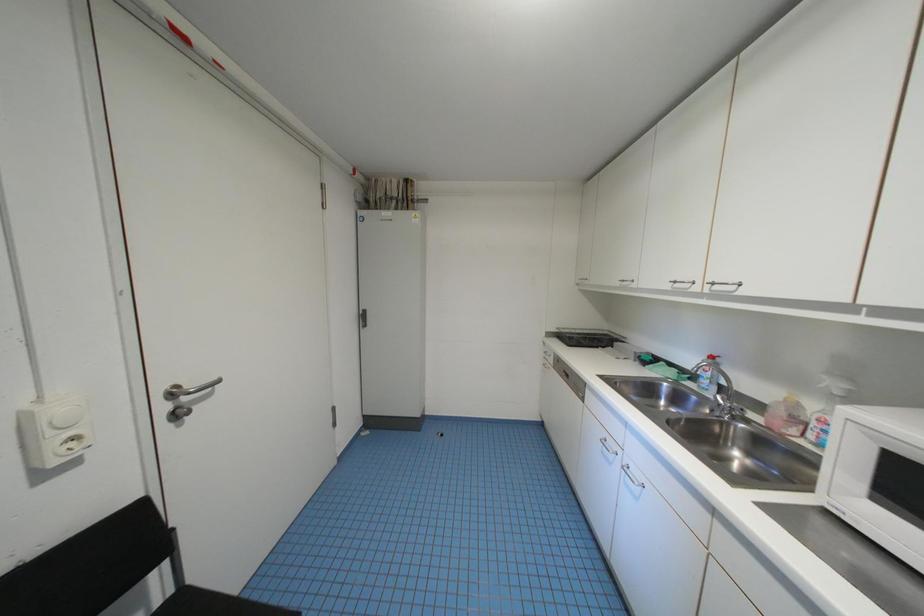
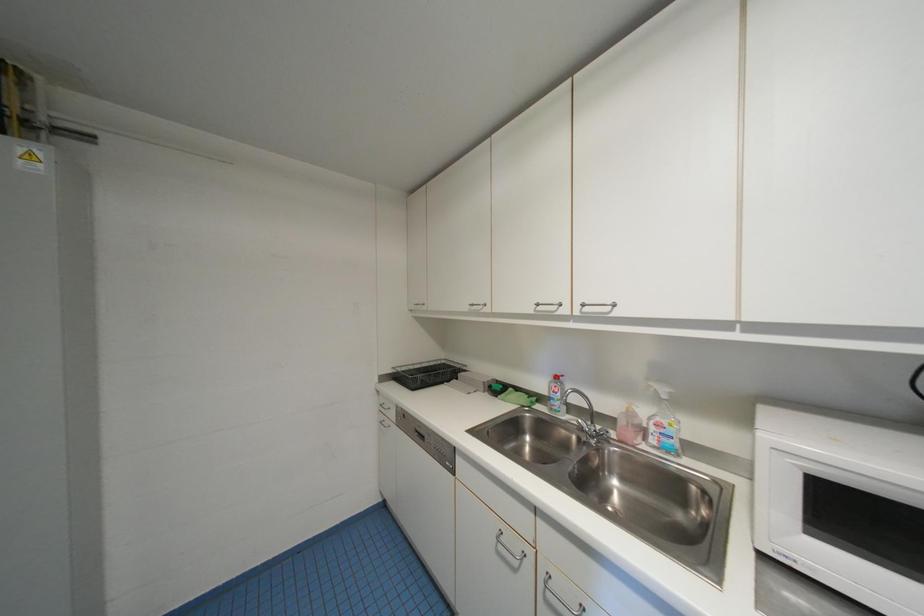
Question: The camera is either moving clockwise (left) or counter-clockwise (right) around the object. The first image is from the beginning of the video and the second image is from the end. Is the camera moving left or right when shooting the video?

Choices:
 (A) Left
 (B) Right

Answer: (A)